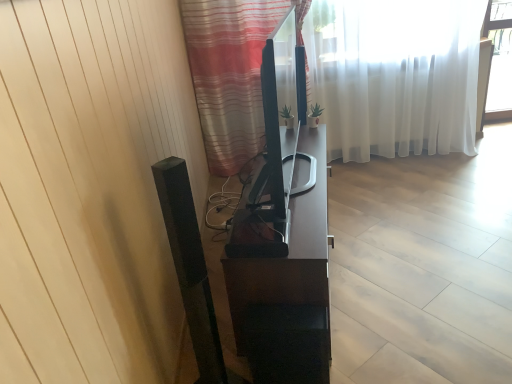
The width and height of the screenshot is (512, 384). What do you see at coordinates (231, 72) in the screenshot?
I see `striped fabric curtain at center, which ranks as the 2th curtain in back-to-front order` at bounding box center [231, 72].

At what (x,y) coordinates should I click in order to perform the action: click on white sheer curtain at upper center, marked as the 1th curtain in a back-to-front arrangement. Please return your answer as a coordinate pair (x, y). Looking at the image, I should click on (395, 75).

Locate an element on the screen. The height and width of the screenshot is (384, 512). satin black tv stand at center is located at coordinates (288, 253).

At what (x,y) coordinates should I click in order to perform the action: click on striped fabric curtain at center, which is counted as the first curtain, starting from the front. Please return your answer as a coordinate pair (x, y). Image resolution: width=512 pixels, height=384 pixels. Looking at the image, I should click on (231, 72).

Considering the relative sizes of satin black tv stand at center and white sheer curtain at upper center, marked as the 1th curtain in a back-to-front arrangement, in the image provided, is satin black tv stand at center shorter than white sheer curtain at upper center, marked as the 1th curtain in a back-to-front arrangement,?

Correct, satin black tv stand at center is not as tall as white sheer curtain at upper center, marked as the 1th curtain in a back-to-front arrangement.

Considering the sizes of objects satin black tv stand at center and white sheer curtain at upper center, marked as the 1th curtain in a back-to-front arrangement, in the image provided, who is thinner, satin black tv stand at center or white sheer curtain at upper center, marked as the 1th curtain in a back-to-front arrangement,?

white sheer curtain at upper center, marked as the 1th curtain in a back-to-front arrangement.

From the image's perspective, is satin black tv stand at center positioned above or below white sheer curtain at upper center, marked as the 1th curtain in a back-to-front arrangement?

Clearly, from the image's perspective, satin black tv stand at center is below white sheer curtain at upper center, marked as the 1th curtain in a back-to-front arrangement.

Looking at the image, does satin black tv stand at center seem bigger or smaller compared to white sheer curtain at upper center, which ranks as the 2th curtain in front-to-back order?

In the image, satin black tv stand at center appears to be smaller than white sheer curtain at upper center, which ranks as the 2th curtain in front-to-back order.

Who is taller, white sheer curtain at upper center, which ranks as the 2th curtain in front-to-back order, or striped fabric curtain at center, which ranks as the 2th curtain in back-to-front order?

With more height is white sheer curtain at upper center, which ranks as the 2th curtain in front-to-back order.

Is white sheer curtain at upper center, which ranks as the 2th curtain in front-to-back order, positioned in front of striped fabric curtain at center, which ranks as the 2th curtain in back-to-front order?

No, white sheer curtain at upper center, which ranks as the 2th curtain in front-to-back order, is further to the viewer.

From the image's perspective, is white sheer curtain at upper center, which ranks as the 2th curtain in front-to-back order, positioned above or below striped fabric curtain at center, which ranks as the 2th curtain in back-to-front order?

Based on their image positions, white sheer curtain at upper center, which ranks as the 2th curtain in front-to-back order, is located above striped fabric curtain at center, which ranks as the 2th curtain in back-to-front order.

Does white sheer curtain at upper center, marked as the 1th curtain in a back-to-front arrangement, touch striped fabric curtain at center, which ranks as the 2th curtain in back-to-front order?

No, white sheer curtain at upper center, marked as the 1th curtain in a back-to-front arrangement, is not touching striped fabric curtain at center, which ranks as the 2th curtain in back-to-front order.

From a real-world perspective, is striped fabric curtain at center, which is counted as the first curtain, starting from the front, on top of satin black tv stand at center?

Correct, in the physical world, striped fabric curtain at center, which is counted as the first curtain, starting from the front, is higher than satin black tv stand at center.

Is striped fabric curtain at center, which ranks as the 2th curtain in back-to-front order, facing towards satin black tv stand at center?

No.

Can you confirm if striped fabric curtain at center, which ranks as the 2th curtain in back-to-front order, is positioned to the left of satin black tv stand at center?

Yes.

There is a satin black tv stand at center. Where is `the 2nd curtain above it (from the image's perspective)`? The height and width of the screenshot is (384, 512). the 2nd curtain above it (from the image's perspective) is located at coordinates (395, 75).

Who is shorter, white sheer curtain at upper center, marked as the 1th curtain in a back-to-front arrangement, or satin black tv stand at center?

With less height is satin black tv stand at center.

Which is closer to the camera, (324, 102) or (329, 336)?

The point (329, 336) is in front.

Which object is further away from the camera, white sheer curtain at upper center, which ranks as the 2th curtain in front-to-back order, or satin black tv stand at center?

white sheer curtain at upper center, which ranks as the 2th curtain in front-to-back order, is more distant.

Does point (219, 33) come behind point (330, 143)?

That is False.

Looking at this image, from the image's perspective, relative to white sheer curtain at upper center, which ranks as the 2th curtain in front-to-back order, is striped fabric curtain at center, which ranks as the 2th curtain in back-to-front order, above or below?

striped fabric curtain at center, which ranks as the 2th curtain in back-to-front order, is below white sheer curtain at upper center, which ranks as the 2th curtain in front-to-back order.

Is striped fabric curtain at center, which ranks as the 2th curtain in back-to-front order, surrounding white sheer curtain at upper center, marked as the 1th curtain in a back-to-front arrangement?

Definitely not — white sheer curtain at upper center, marked as the 1th curtain in a back-to-front arrangement, is not inside striped fabric curtain at center, which ranks as the 2th curtain in back-to-front order.

Consider the image. Does striped fabric curtain at center, which ranks as the 2th curtain in back-to-front order, have a greater height compared to white sheer curtain at upper center, which ranks as the 2th curtain in front-to-back order?

In fact, striped fabric curtain at center, which ranks as the 2th curtain in back-to-front order, may be shorter than white sheer curtain at upper center, which ranks as the 2th curtain in front-to-back order.

Based on the photo, is satin black tv stand at center next to striped fabric curtain at center, which ranks as the 2th curtain in back-to-front order?

They are not placed beside each other.

From a real-world perspective, who is located higher, satin black tv stand at center or striped fabric curtain at center, which ranks as the 2th curtain in back-to-front order?

striped fabric curtain at center, which ranks as the 2th curtain in back-to-front order, from a real-world perspective.

Consider the image. From the image's perspective, which one is positioned lower, satin black tv stand at center or striped fabric curtain at center, which is counted as the first curtain, starting from the front?

satin black tv stand at center is shown below in the image.

Considering the relative sizes of satin black tv stand at center and striped fabric curtain at center, which is counted as the first curtain, starting from the front, in the image provided, is satin black tv stand at center shorter than striped fabric curtain at center, which is counted as the first curtain, starting from the front,?

Yes, satin black tv stand at center is shorter than striped fabric curtain at center, which is counted as the first curtain, starting from the front.

You are a GUI agent. You are given a task and a screenshot of the screen. Output one action in this format:
    pyautogui.click(x=<x>, y=<y>)
    Task: Click on the furniture located in front of the white sheer curtain at upper center, marked as the 1th curtain in a back-to-front arrangement
    Image resolution: width=512 pixels, height=384 pixels.
    Given the screenshot: What is the action you would take?
    pyautogui.click(x=288, y=253)

The height and width of the screenshot is (384, 512). What are the coordinates of `curtain above the white sheer curtain at upper center, marked as the 1th curtain in a back-to-front arrangement (from a real-world perspective)` in the screenshot? It's located at (231, 72).

Which object lies nearer to the anchor point striped fabric curtain at center, which is counted as the first curtain, starting from the front, white sheer curtain at upper center, which ranks as the 2th curtain in front-to-back order, or satin black tv stand at center?

white sheer curtain at upper center, which ranks as the 2th curtain in front-to-back order, is positioned closer to the anchor striped fabric curtain at center, which is counted as the first curtain, starting from the front.

Estimate the real-world distances between objects in this image. Which object is further from satin black tv stand at center, striped fabric curtain at center, which is counted as the first curtain, starting from the front, or white sheer curtain at upper center, marked as the 1th curtain in a back-to-front arrangement?

The object further to satin black tv stand at center is white sheer curtain at upper center, marked as the 1th curtain in a back-to-front arrangement.

Considering their positions, is satin black tv stand at center positioned closer to white sheer curtain at upper center, marked as the 1th curtain in a back-to-front arrangement, than striped fabric curtain at center, which is counted as the first curtain, starting from the front?

The object closer to white sheer curtain at upper center, marked as the 1th curtain in a back-to-front arrangement, is striped fabric curtain at center, which is counted as the first curtain, starting from the front.

When comparing their distances from striped fabric curtain at center, which ranks as the 2th curtain in back-to-front order, does satin black tv stand at center or white sheer curtain at upper center, which ranks as the 2th curtain in front-to-back order, seem closer?

Among the two, white sheer curtain at upper center, which ranks as the 2th curtain in front-to-back order, is located nearer to striped fabric curtain at center, which ranks as the 2th curtain in back-to-front order.

Considering their positions, is white sheer curtain at upper center, which ranks as the 2th curtain in front-to-back order, positioned further to satin black tv stand at center than striped fabric curtain at center, which ranks as the 2th curtain in back-to-front order?

Among the two, white sheer curtain at upper center, which ranks as the 2th curtain in front-to-back order, is located further to satin black tv stand at center.

Estimate the real-world distances between objects in this image. Which object is further from white sheer curtain at upper center, which ranks as the 2th curtain in front-to-back order, striped fabric curtain at center, which ranks as the 2th curtain in back-to-front order, or satin black tv stand at center?

satin black tv stand at center lies further to white sheer curtain at upper center, which ranks as the 2th curtain in front-to-back order, than the other object.

Identify the location of furniture positioned between striped fabric curtain at center, which ranks as the 2th curtain in back-to-front order, and white sheer curtain at upper center, which ranks as the 2th curtain in front-to-back order, from near to far. This screenshot has width=512, height=384. (288, 253).